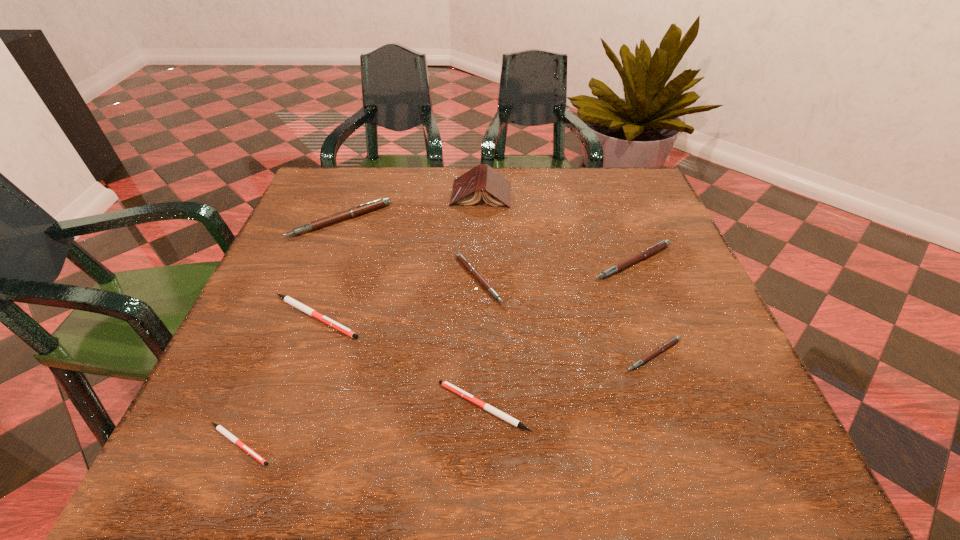
The width and height of the screenshot is (960, 540). Find the location of `vacant space that's between the second tallest pen and the brown book`. vacant space that's between the second tallest pen and the brown book is located at coordinates (557, 228).

Identify the location of vacant point located between the brown book and the smallest white pen. (360, 319).

Identify which object is the sixth nearest to the nearest pink pen. Please provide its 2D coordinates. Your answer should be formatted as a tuple, i.e. [(x, y)], where the tuple contains the x and y coordinates of a point satisfying the conditions above.

[(361, 209)]

You are a GUI agent. You are given a task and a screenshot of the screen. Output one action in this format:
    pyautogui.click(x=<x>, y=<y>)
    Task: Click on the fifth closest object to the third biggest pink pen
    
    Given the screenshot: What is the action you would take?
    pyautogui.click(x=653, y=249)

Point out which pen is positioned as the nearest to the third pink pen from right to left. Please provide its 2D coordinates. Your answer should be formatted as a tuple, i.e. [(x, y)], where the tuple contains the x and y coordinates of a point satisfying the conditions above.

[(287, 299)]

Select which pen appears as the closest to the shortest object. Please provide its 2D coordinates. Your answer should be formatted as a tuple, i.e. [(x, y)], where the tuple contains the x and y coordinates of a point satisfying the conditions above.

[(287, 299)]

Identify which pink pen is located as the nearest to the second smallest white pen. Please provide its 2D coordinates. Your answer should be formatted as a tuple, i.e. [(x, y)], where the tuple contains the x and y coordinates of a point satisfying the conditions above.

[(672, 341)]

Choose which pink pen is the nearest neighbor to the second biggest pink pen. Please provide its 2D coordinates. Your answer should be formatted as a tuple, i.e. [(x, y)], where the tuple contains the x and y coordinates of a point satisfying the conditions above.

[(672, 341)]

Identify which white pen is located as the third nearest to the seventh shortest object. Please provide its 2D coordinates. Your answer should be formatted as a tuple, i.e. [(x, y)], where the tuple contains the x and y coordinates of a point satisfying the conditions above.

[(222, 430)]

Where is `white pen object that ranks as the second closest to the nearest pink pen`? The width and height of the screenshot is (960, 540). white pen object that ranks as the second closest to the nearest pink pen is located at coordinates (287, 299).